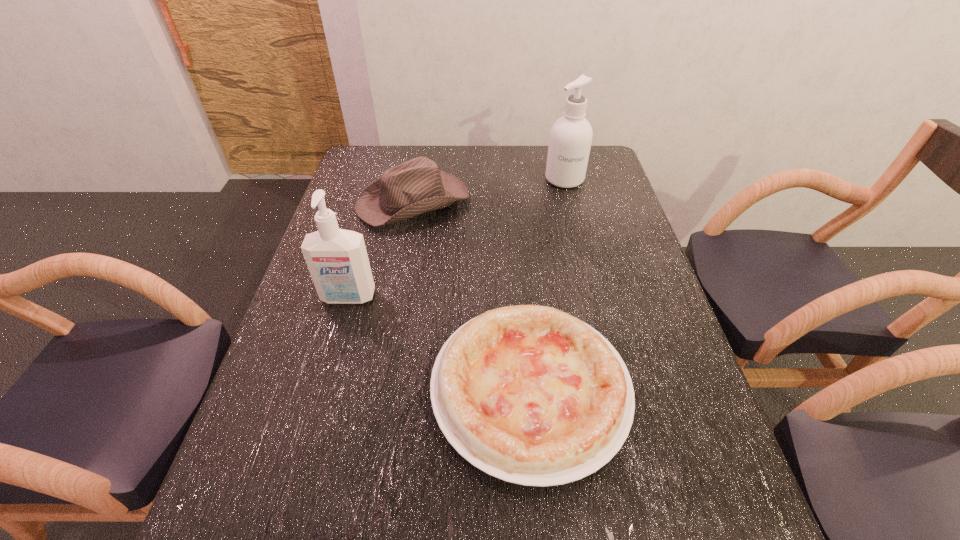
This screenshot has height=540, width=960. In order to click on vacant region between the pizza and the nearer cleansing agent in this screenshot , I will do `click(439, 343)`.

I want to click on vacant space that is in between the left cleansing agent and the right cleansing agent, so click(456, 238).

You are a GUI agent. You are given a task and a screenshot of the screen. Output one action in this format:
    pyautogui.click(x=<x>, y=<y>)
    Task: Click on the third closest object to the second nearest object
    The image size is (960, 540).
    Given the screenshot: What is the action you would take?
    pyautogui.click(x=571, y=135)

I want to click on object that stands as the third closest to the second shortest object, so coord(529,394).

Locate an element on the screen. Image resolution: width=960 pixels, height=540 pixels. vacant region that satisfies the following two spatial constraints: 1. on the front label of the left cleansing agent; 2. on the right side of the nearest object is located at coordinates (323, 389).

Where is `free spot that satisfies the following two spatial constraints: 1. on the front label of the shortest object; 2. on the right side of the left cleansing agent`? free spot that satisfies the following two spatial constraints: 1. on the front label of the shortest object; 2. on the right side of the left cleansing agent is located at coordinates (323, 389).